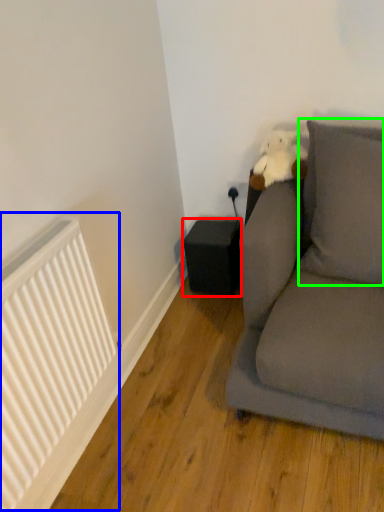
Question: Which object is the farthest from speaker (highlighted by a red box)? Choose among these: radiator (highlighted by a blue box) or pillow (highlighted by a green box).

Choices:
 (A) radiator
 (B) pillow

Answer: (A)